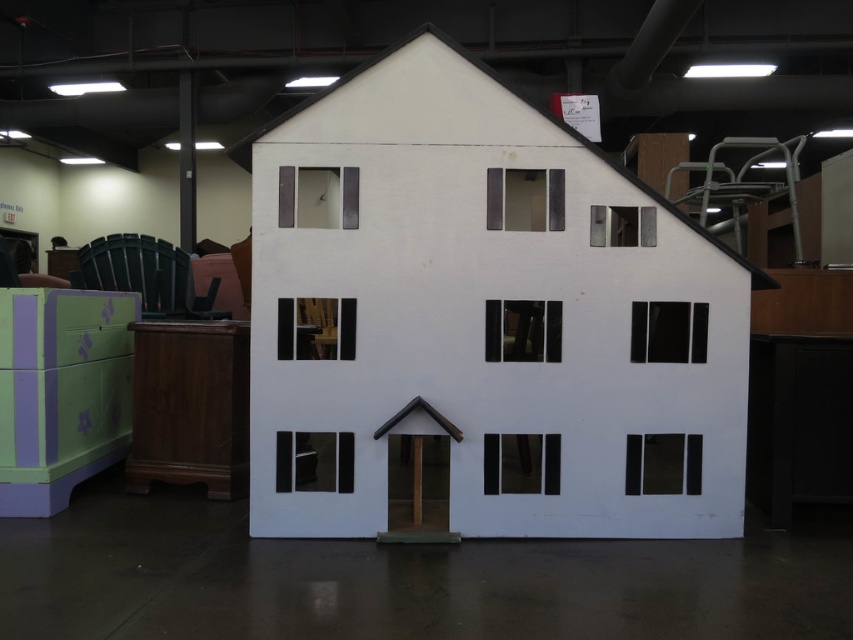
Question: Which point is farther to the camera?

Choices:
 (A) (726, 461)
 (B) (413, 532)

Answer: (A)

Question: Among these points, which one is nearest to the camera?

Choices:
 (A) (405, 541)
 (B) (567, 422)

Answer: (A)

Question: Observing the image, what is the correct spatial positioning of white matte house at center in reference to matte brown door at center?

Choices:
 (A) right
 (B) left

Answer: (A)

Question: Does white matte house at center lie in front of matte brown door at center?

Choices:
 (A) yes
 (B) no

Answer: (A)

Question: Is white matte house at center smaller than matte brown door at center?

Choices:
 (A) no
 (B) yes

Answer: (A)